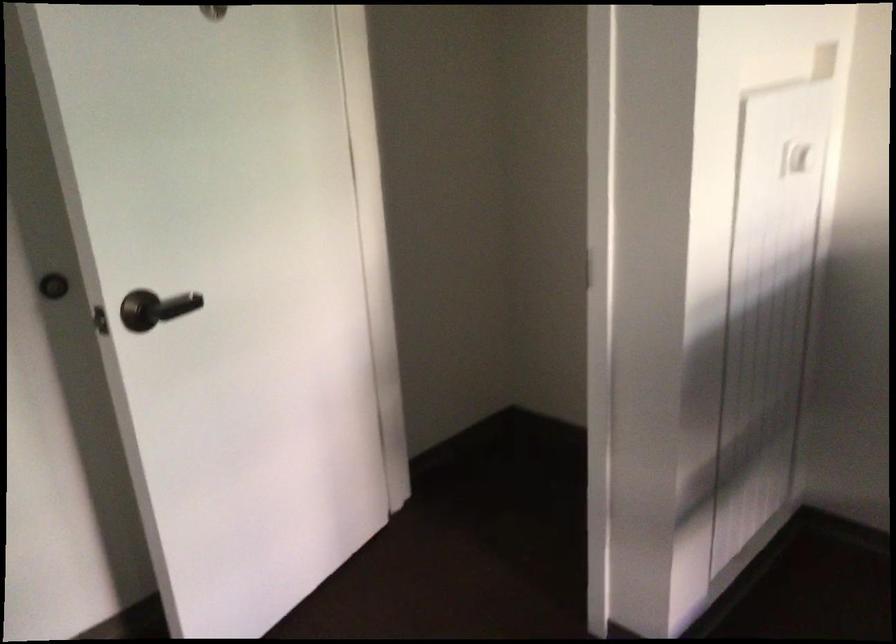
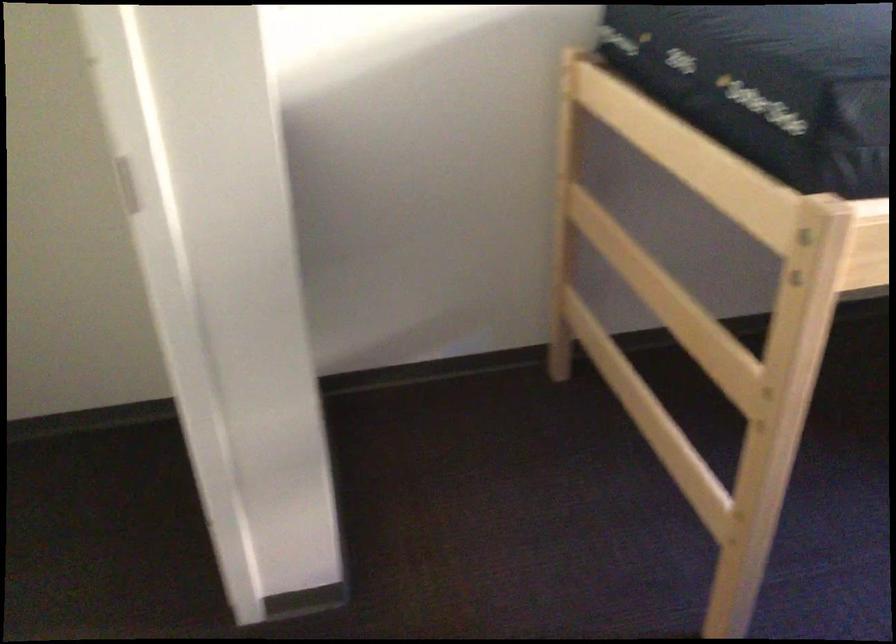
How did the camera likely rotate?

The rotation direction of the camera is right-down.